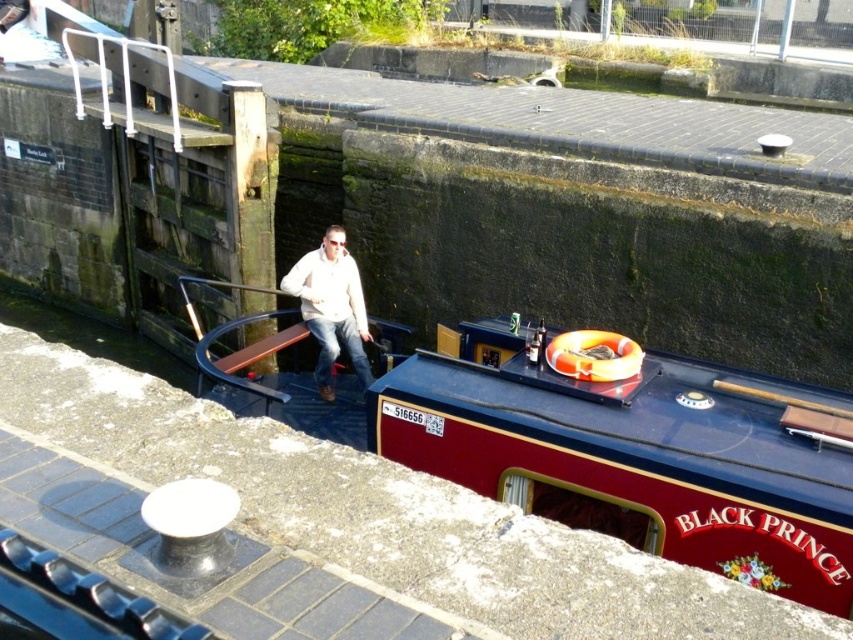
You are standing on the dock next to the maroon polished wood boat at center and the white matte jacket at center. Which object is nearer to you?

The maroon polished wood boat at center is closer to you than the white matte jacket at center.

You are standing on the dock next to the canal and see the maroon polished wood boat at center and the white matte jacket at center. Which object is closer to the water surface?

The maroon polished wood boat at center is located below the white matte jacket at center, so it is closer to the water surface.